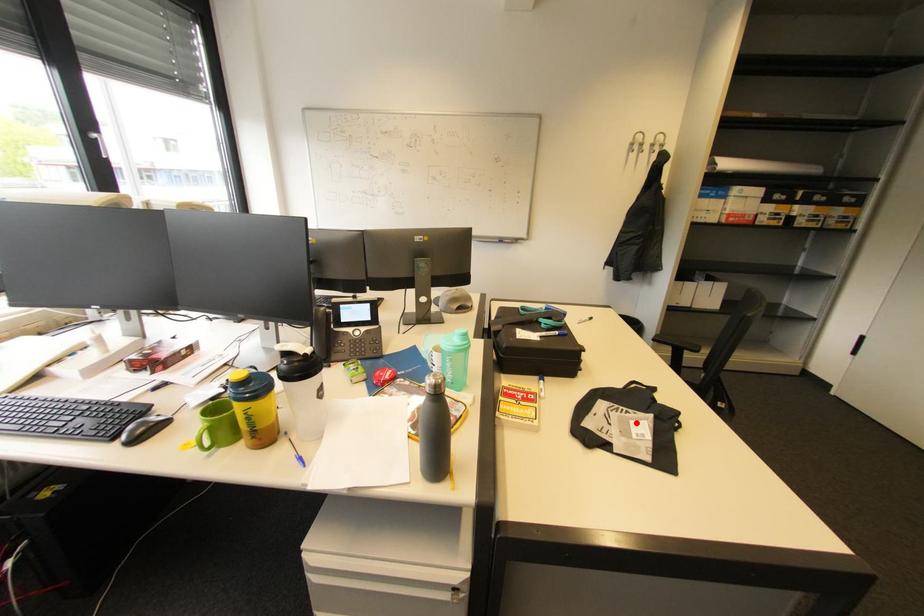
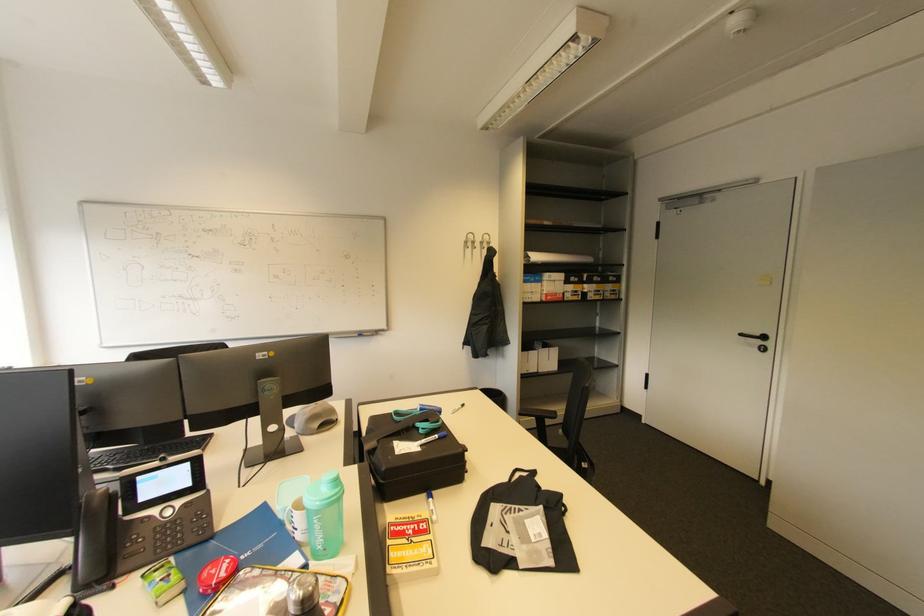
Locate, in the second image, the point that corresponds to the highlighted location in the first image.

(531, 523)